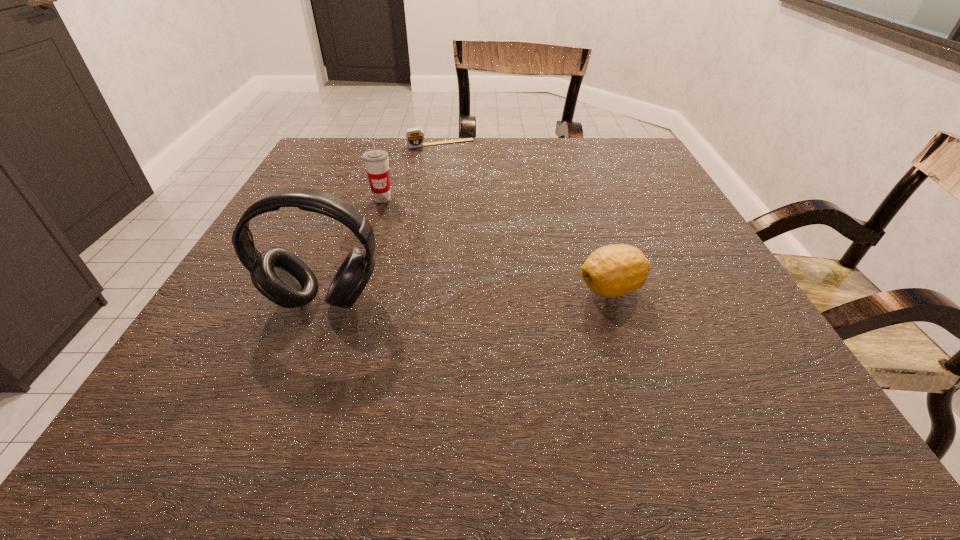
In order to click on free space at the far edge of the desktop in this screenshot , I will do `click(407, 155)`.

Where is `vacant space at the near edge of the desktop`? vacant space at the near edge of the desktop is located at coordinates (296, 374).

Where is `vacant space at the left edge of the desktop`? vacant space at the left edge of the desktop is located at coordinates (333, 181).

Locate an element on the screen. The height and width of the screenshot is (540, 960). vacant area at the right edge of the desktop is located at coordinates (647, 286).

This screenshot has height=540, width=960. Identify the location of vacant space at the far left corner of the desktop. (313, 179).

Locate an element on the screen. vacant space at the near left corner is located at coordinates (238, 359).

Where is `vacant space at the far right corner`? The width and height of the screenshot is (960, 540). vacant space at the far right corner is located at coordinates [638, 151].

Find the location of a particular element. This screenshot has width=960, height=540. vacant space at the near right corner of the desktop is located at coordinates (766, 350).

The image size is (960, 540). I want to click on free point between the headset and the rightmost object, so click(468, 295).

The height and width of the screenshot is (540, 960). What are the coordinates of `free space between the shortest object and the third shortest object` in the screenshot? It's located at (412, 171).